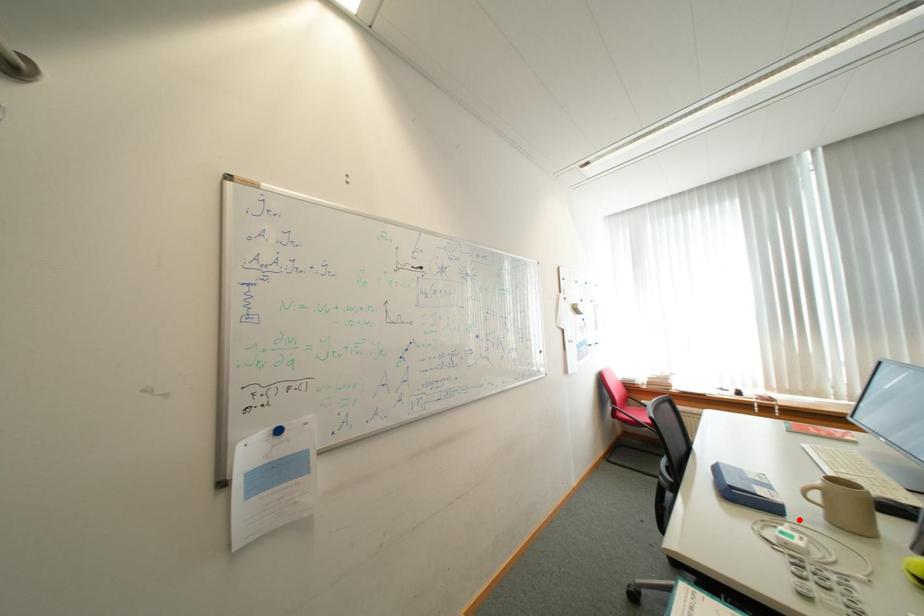
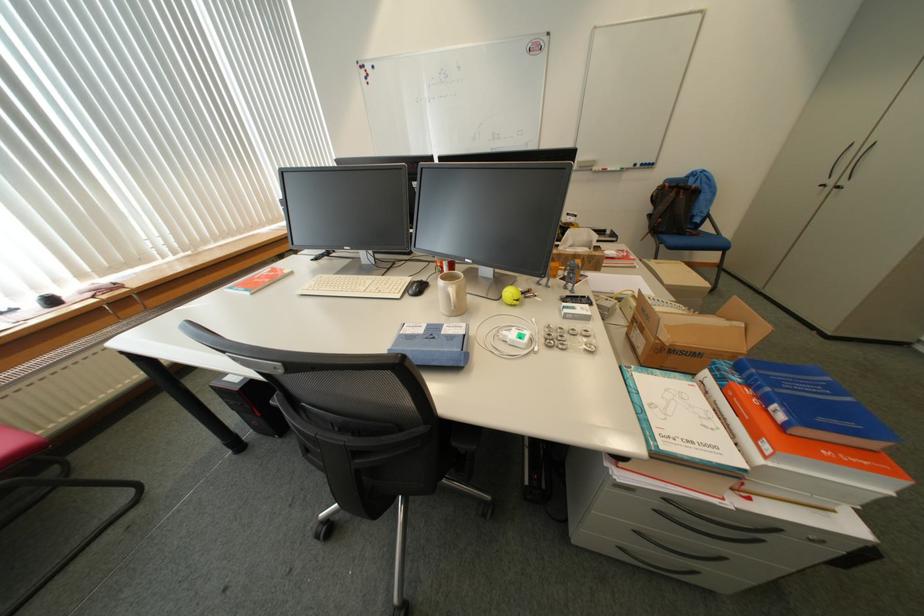
Question: I am providing you with two images of the same scene from different viewpoints. A red point is marked on the first image. Is the red point's position out of view in image 2?

Choices:
 (A) Yes
 (B) No

Answer: (B)